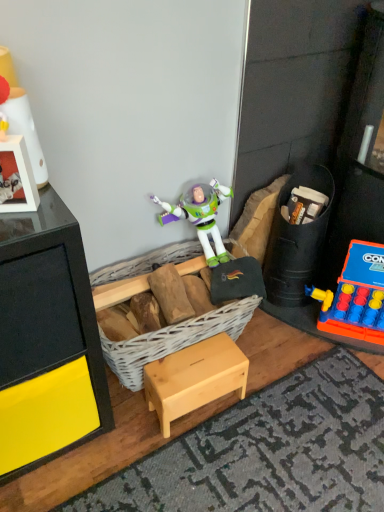
Find the location of a particular element. vacant area to the left of natural wood stool at center is located at coordinates (128, 422).